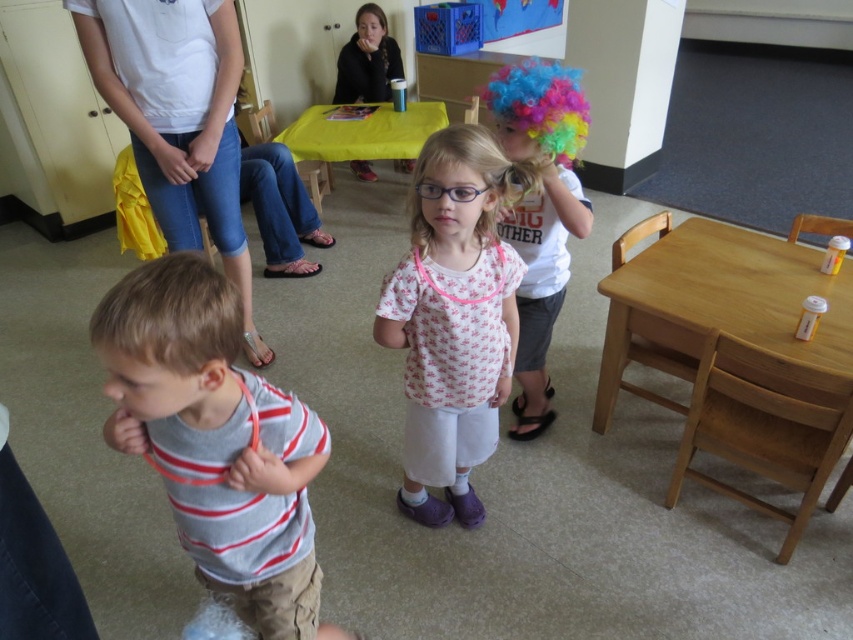
You are a teacher in the classroom and need to place a new poster that is 1 meter wide. The poster must be placed on either the light brown wooden table at right or the multicolored wig at upper center. Which object can accommodate the poster without overlapping its edges?

The light brown wooden table at right can accommodate the poster since its width is larger than the multicolored wig at upper center, making it suitable for the 1 meter wide poster.

You are standing in the classroom and want to reach a point that is 1.59 meters away from you. Can you walk straight to point (502, 154)?

Yes, the point (502, 154) is 1.59 meters away from you, so you can walk straight to it.